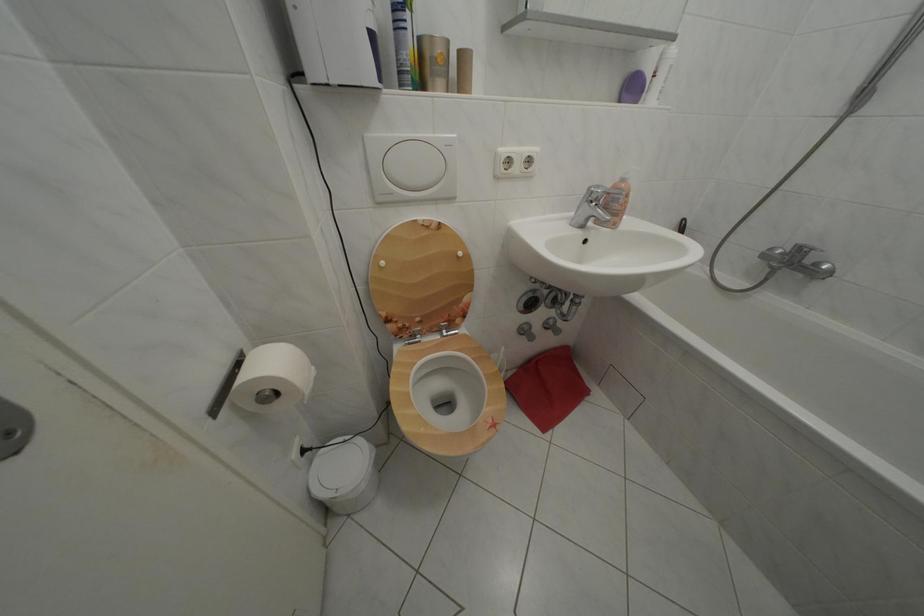
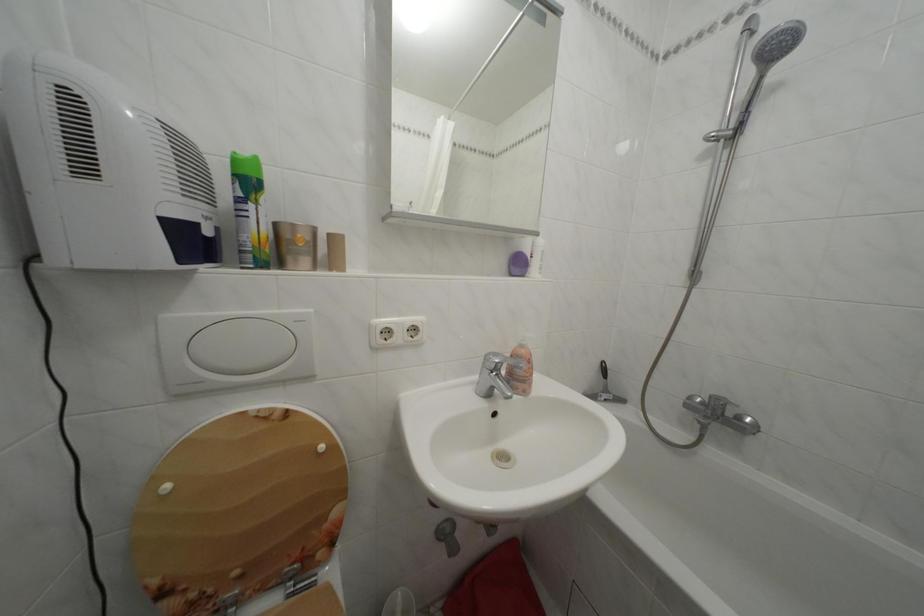
Locate, in the second image, the point that corresponds to point 392,269 in the first image.

(176, 493)